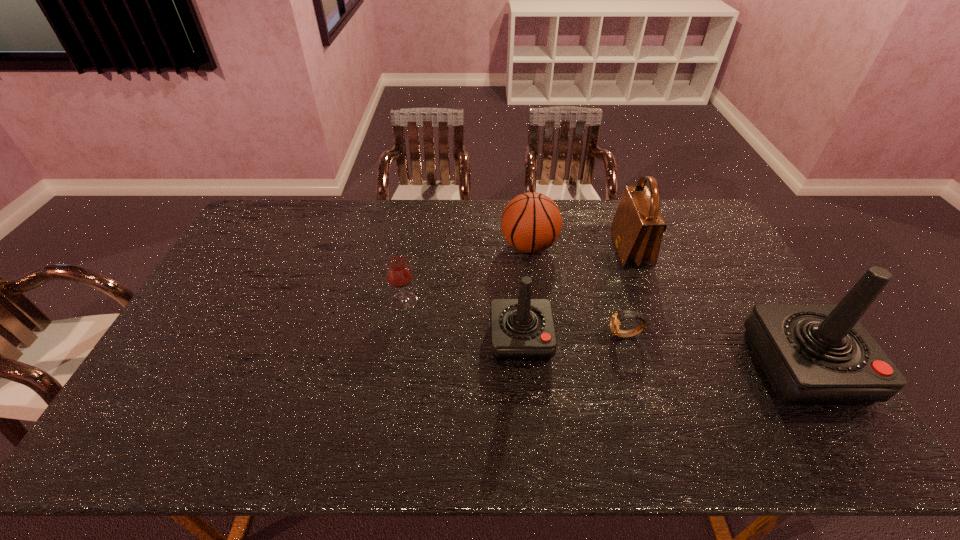
At what (x,y) coordinates should I click in order to perform the action: click on free space located 0.210m on the face of the shortest object. Please return your answer as a coordinate pair (x, y). The height and width of the screenshot is (540, 960). Looking at the image, I should click on (536, 335).

Locate an element on the screen. The image size is (960, 540). shoulder bag at the far edge is located at coordinates (637, 229).

Find the location of a particular element. This screenshot has width=960, height=540. basketball that is at the far edge is located at coordinates (531, 222).

I want to click on object located at the near edge, so click(812, 354).

I want to click on object at the right edge, so click(812, 354).

Find the location of `object that is positioned at the near right corner`. object that is positioned at the near right corner is located at coordinates (812, 354).

The image size is (960, 540). What are the coordinates of `vacant space at the far edge of the desktop` in the screenshot? It's located at (344, 202).

Identify the location of vacant space at the near edge. (420, 397).

At what (x,y) coordinates should I click in order to perform the action: click on vacant space at the left edge of the desktop. Please return your answer as a coordinate pair (x, y). This screenshot has width=960, height=540. Looking at the image, I should click on (257, 283).

The width and height of the screenshot is (960, 540). Find the location of `vacant space at the right edge of the desktop`. vacant space at the right edge of the desktop is located at coordinates (735, 314).